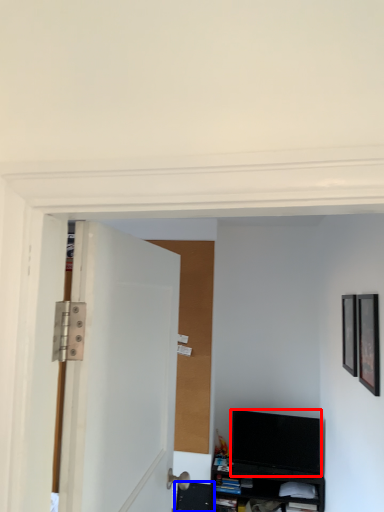
Question: Which point is further to the camera, television (highlighted by a red box) or shelf (highlighted by a blue box)?

Choices:
 (A) television
 (B) shelf

Answer: (B)